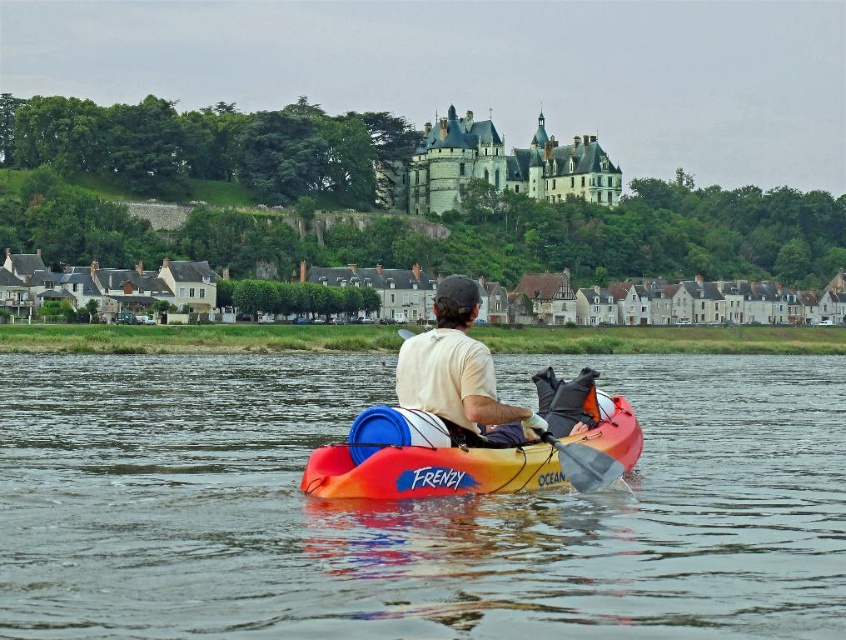
You are a photographer trying to capture the stone gray castle at upper center and the gray fabric paddle at center in the same frame. Based on their sizes in the image, which object would likely require you to adjust your camera to a wider angle to include both in the shot?

The stone gray castle at upper center might be wider than the gray fabric paddle at center, so you would need to adjust your camera to a wider angle to include both in the shot.

You are a photographer standing on the riverside. You want to take a photo of the white fabric shirt at center and the stone gray castle at upper center. Which object should you focus on first to ensure both are in the frame?

You should focus on the stone gray castle at upper center first because the white fabric shirt at center is behind it, so positioning the camera to include the castle will naturally include the shirt in the background.

You are a photographer trying to capture the stone gray castle at upper center and the gray fabric paddle at center in a single shot. Based on their positions, which object would appear closer to the top of your camera frame?

The stone gray castle at upper center is positioned over the gray fabric paddle at center, so it would appear closer to the top of the camera frame.